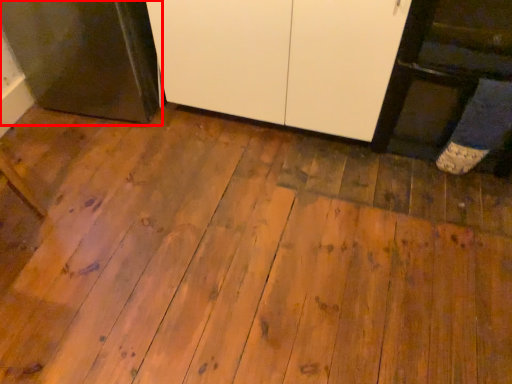
Question: In this image, where is appliance (annotated by the red box) located relative to cabinetry?

Choices:
 (A) right
 (B) left

Answer: (B)